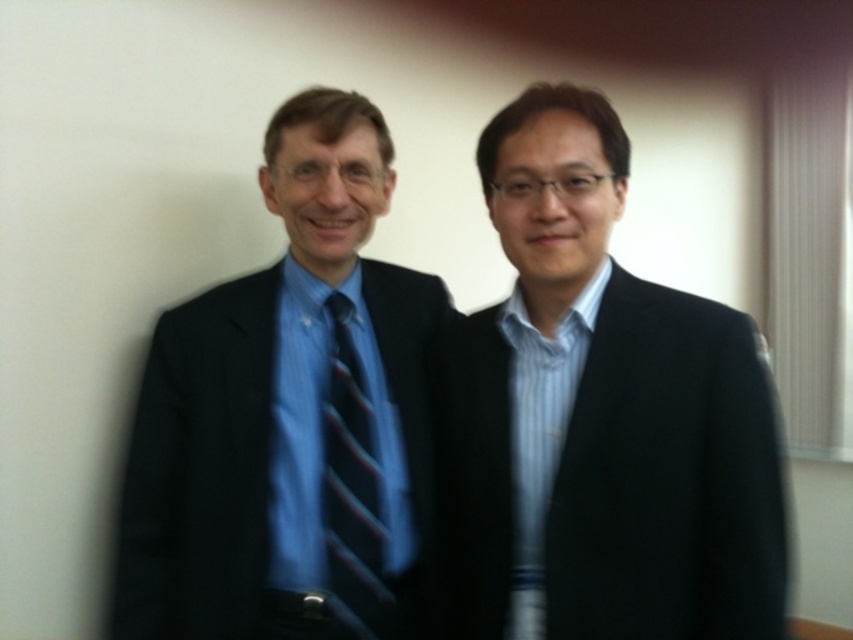
Question: Which of these objects is positioned farthest from the matte black suit at left?

Choices:
 (A) matte black suit at right
 (B) blue striped tie at center

Answer: (A)

Question: Can you confirm if matte black suit at right is positioned below blue striped tie at center?

Choices:
 (A) no
 (B) yes

Answer: (A)

Question: Does matte black suit at left have a smaller size compared to blue striped tie at center?

Choices:
 (A) yes
 (B) no

Answer: (B)

Question: Which object is positioned farthest from the blue striped tie at center?

Choices:
 (A) matte black suit at left
 (B) matte black suit at right

Answer: (B)

Question: Which object appears closest to the camera in this image?

Choices:
 (A) blue striped tie at center
 (B) matte black suit at right
 (C) matte black suit at left

Answer: (B)

Question: Is matte black suit at right positioned before blue striped tie at center?

Choices:
 (A) yes
 (B) no

Answer: (A)